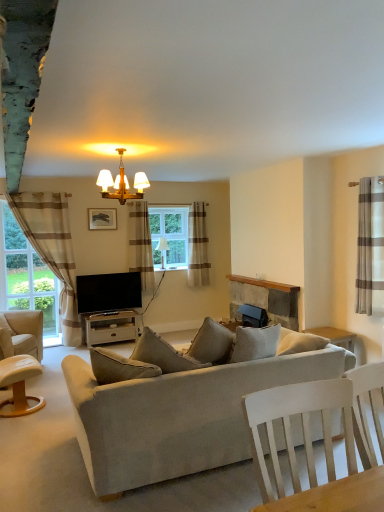
The image size is (384, 512). What do you see at coordinates (162, 250) in the screenshot?
I see `matte white lampshade at center, which is the 2th lamp in front-to-back order` at bounding box center [162, 250].

How much space does matte white lampshade at center, which is counted as the 1th lamp, starting from the back, occupy vertically?

20.63 inches.

Measure the distance between point (x=9, y=386) and camera.

The distance of point (x=9, y=386) from camera is 3.90 meters.

This screenshot has width=384, height=512. Describe the element at coordinates (19, 385) in the screenshot. I see `light brown wooden chair at lower left, the second chair viewed from the back` at that location.

Locate an element on the screen. This screenshot has width=384, height=512. matte black picture frame at upper center is located at coordinates (102, 218).

What is the approximate height of white wood tv stand at center?

white wood tv stand at center is 17.40 inches in height.

In order to face flat screen tv at center, should I rotate leftwards or rightwards?

You should look left and rotate roughly 10.800 degrees.

The height and width of the screenshot is (512, 384). Find the location of `matte white lampshade at center, which is counted as the second lamp, starting from the top`. matte white lampshade at center, which is counted as the second lamp, starting from the top is located at coordinates (162, 250).

In the scene shown: How different are the orientations of matte white lampshade at center, which is the 2th lamp in front-to-back order, and beige striped curtain at center, placed as the 3th curtain when sorted from left to right, in degrees?

0.0049 degrees.

In terms of height, does matte white lampshade at center, which is the 2th lamp in front-to-back order, look taller or shorter compared to beige striped curtain at center, placed as the 3th curtain when sorted from left to right?

Considering their sizes, matte white lampshade at center, which is the 2th lamp in front-to-back order, has less height than beige striped curtain at center, placed as the 3th curtain when sorted from left to right.

Identify the location of curtain that is the 1st one when counting rightward from the matte white lampshade at center, the 1th lamp positioned from the bottom. (198, 246).

How much distance is there between matte white lampshade at center, which is counted as the 1th lamp, starting from the back, and beige striped curtain at center, marked as the second curtain in a right-to-left arrangement?

matte white lampshade at center, which is counted as the 1th lamp, starting from the back, and beige striped curtain at center, marked as the second curtain in a right-to-left arrangement, are 21.22 inches apart from each other.

Is beige striped curtain at left, which is the 4th curtain from right to left, positioned before beige fabric couch at center?

No, it is not.

Is beige striped curtain at left, arranged as the 2th curtain when viewed from the front, looking in the opposite direction of beige fabric couch at center?

No, beige striped curtain at left, arranged as the 2th curtain when viewed from the front,'s orientation is not away from beige fabric couch at center.

From the image's perspective, relative to beige fabric couch at center, is beige striped curtain at left, which is the 4th curtain from right to left, above or below?

beige striped curtain at left, which is the 4th curtain from right to left, is situated higher than beige fabric couch at center in the image.

Which is in front, point (64, 270) or point (131, 405)?

The point (131, 405) is in front.

Does point (64, 312) appear closer or farther from the camera than point (16, 392)?

Point (64, 312).

Would you say beige striped curtain at left, the 3th curtain when ordered from back to front, is outside light brown wooden chair at lower left, the 1th chair viewed from the right?

Absolutely, beige striped curtain at left, the 3th curtain when ordered from back to front, is external to light brown wooden chair at lower left, the 1th chair viewed from the right.

Between beige striped curtain at left, placed as the 1th curtain when sorted from left to right, and light brown wooden chair at lower left, placed as the second chair when sorted from left to right, which one has less height?

light brown wooden chair at lower left, placed as the second chair when sorted from left to right.

Is beige striped curtain at left, placed as the 1th curtain when sorted from left to right, oriented away from light brown wooden chair at lower left, arranged as the 1th chair when viewed from the front?

No.

Is beige fabric couch at center not close to light brown wooden chair at lower left, the 1th chair viewed from the right?

Yes, beige fabric couch at center and light brown wooden chair at lower left, the 1th chair viewed from the right, are quite far apart.

Would you say beige fabric couch at center is outside light brown wooden chair at lower left, arranged as the 1th chair when viewed from the front?

Yes.

Does point (281, 373) come in front of point (30, 358)?

Yes, it is.

Considering the relative sizes of beige fabric couch at center and light brown wooden chair at lower left, the second chair viewed from the back, in the image provided, is beige fabric couch at center bigger than light brown wooden chair at lower left, the second chair viewed from the back,?

Correct, beige fabric couch at center is larger in size than light brown wooden chair at lower left, the second chair viewed from the back.

Are light brown wooden chair at lower left, placed as the second chair when sorted from left to right, and flat screen tv at center making contact?

No, light brown wooden chair at lower left, placed as the second chair when sorted from left to right, is not in contact with flat screen tv at center.

From the image's perspective, starting from the flat screen tv at center, which chair is the 2nd one below? Please provide its 2D coordinates.

[(19, 385)]

Is light brown wooden chair at lower left, the 1th chair viewed from the right, inside the boundaries of flat screen tv at center, or outside?

light brown wooden chair at lower left, the 1th chair viewed from the right, is located beyond the bounds of flat screen tv at center.

Looking at their sizes, would you say light brown wooden chair at lower left, arranged as the 1th chair when viewed from the front, is wider or thinner than flat screen tv at center?

Clearly, light brown wooden chair at lower left, arranged as the 1th chair when viewed from the front, has more width compared to flat screen tv at center.

From the image's perspective, relative to rustic stone fireplace at center, is beige fabric chair at left, which is the 1th chair in back-to-front order, above or below?

From the image's perspective, beige fabric chair at left, which is the 1th chair in back-to-front order, appears below rustic stone fireplace at center.

How distant is beige fabric chair at left, the second chair viewed from the right, from rustic stone fireplace at center?

beige fabric chair at left, the second chair viewed from the right, is 9.13 feet away from rustic stone fireplace at center.

Does point (17, 340) come closer to viewer compared to point (232, 313)?

Yes.

Does brown striped curtain at center, the third curtain from the front, have a greater height compared to beige striped curtain at left, which is the 4th curtain from right to left?

No, brown striped curtain at center, the third curtain from the front, is not taller than beige striped curtain at left, which is the 4th curtain from right to left.

Is brown striped curtain at center, which appears as the 2th curtain when viewed from the back, aimed at beige striped curtain at left, placed as the 1th curtain when sorted from left to right?

No, brown striped curtain at center, which appears as the 2th curtain when viewed from the back, is not oriented towards beige striped curtain at left, placed as the 1th curtain when sorted from left to right.

How many degrees apart are the facing directions of brown striped curtain at center, the third curtain from the front, and beige striped curtain at left, placed as the 1th curtain when sorted from left to right?

The angle between the facing direction of brown striped curtain at center, the third curtain from the front, and the facing direction of beige striped curtain at left, placed as the 1th curtain when sorted from left to right, is 0.223 degrees.

Looking at this image, which object is further away from the camera taking this photo, brown striped curtain at center, the third curtain from the front, or beige striped curtain at left, placed as the 1th curtain when sorted from left to right?

brown striped curtain at center, the third curtain from the front, is further from the camera.

Find the location of a particular element. lamp located underneath the beige striped curtain at center, positioned as the 1th curtain in back-to-front order (from a real-world perspective) is located at coordinates (162, 250).

From a real-world perspective, count 1st curtains upward from the beige fabric couch at center and point to it. Please provide its 2D coordinates.

[(52, 248)]

Looking at the image, which one is located closer to flat screen tv at center, matte black picture frame at upper center or matte white lampshade at center, which is the 2th lamp in front-to-back order?

Among the two, matte black picture frame at upper center is located nearer to flat screen tv at center.

Which object lies nearer to the anchor point flat screen tv at center, beige striped curtain at left, which is the 4th curtain from right to left, or light brown wooden chair at lower left, the second chair viewed from the back?

Among the two, beige striped curtain at left, which is the 4th curtain from right to left, is located nearer to flat screen tv at center.

Looking at the image, which one is located further to white wood tv stand at center, rustic stone fireplace at center or brown striped curtain at center, which appears as the 2th curtain when viewed from the back?

rustic stone fireplace at center is positioned further to the anchor white wood tv stand at center.

Looking at the image, which one is located further to brown striped curtain at center, the 2th curtain viewed from the left, light brown wooden chair at lower left, arranged as the 1th chair when viewed from the front, or beige fabric couch at center?

Based on the image, beige fabric couch at center appears to be further to brown striped curtain at center, the 2th curtain viewed from the left.

Looking at the image, which one is located closer to white wood tv stand at center, matte black picture frame at upper center or matte white lampshade at center, which is the 2th lamp in front-to-back order?

Among the two, matte white lampshade at center, which is the 2th lamp in front-to-back order, is located nearer to white wood tv stand at center.

Looking at the image, which one is located closer to beige fabric couch at center, beige fabric chair at left, arranged as the first chair when viewed from the left, or beige striped curtain at center, placed as the 3th curtain when sorted from left to right?

beige fabric chair at left, arranged as the first chair when viewed from the left, is closer to beige fabric couch at center.

Which object lies nearer to the anchor point matte gold chandelier at upper center, marked as the 1th lamp in a front-to-back arrangement, white wood tv stand at center or clear glass window at center?

clear glass window at center lies closer to matte gold chandelier at upper center, marked as the 1th lamp in a front-to-back arrangement, than the other object.

Estimate the real-world distances between objects in this image. Which object is closer to white wood tv stand at center, beige striped curtain at center, marked as the second curtain in a right-to-left arrangement, or beige fabric couch at center?

The object closer to white wood tv stand at center is beige striped curtain at center, marked as the second curtain in a right-to-left arrangement.

The height and width of the screenshot is (512, 384). I want to click on television between matte black picture frame at upper center and beige striped curtain at right, marked as the 1th curtain in a right-to-left arrangement, from left to right, so click(x=108, y=292).

This screenshot has height=512, width=384. In order to click on table positioned between beige fabric couch at center and beige striped curtain at center, marked as the second curtain in a right-to-left arrangement, from near to far in this screenshot , I will do `click(111, 327)`.

This screenshot has width=384, height=512. Identify the location of picture frame between light brown wooden chair at lower left, placed as the second chair when sorted from left to right, and brown striped curtain at center, which appears as the 2th curtain when viewed from the back, along the z-axis. (102, 218).

Where is `television between beige fabric chair at left, which is the 1th chair in back-to-front order, and brown striped curtain at center, the 2th curtain viewed from the left, from front to back`? This screenshot has width=384, height=512. television between beige fabric chair at left, which is the 1th chair in back-to-front order, and brown striped curtain at center, the 2th curtain viewed from the left, from front to back is located at coordinates (108, 292).